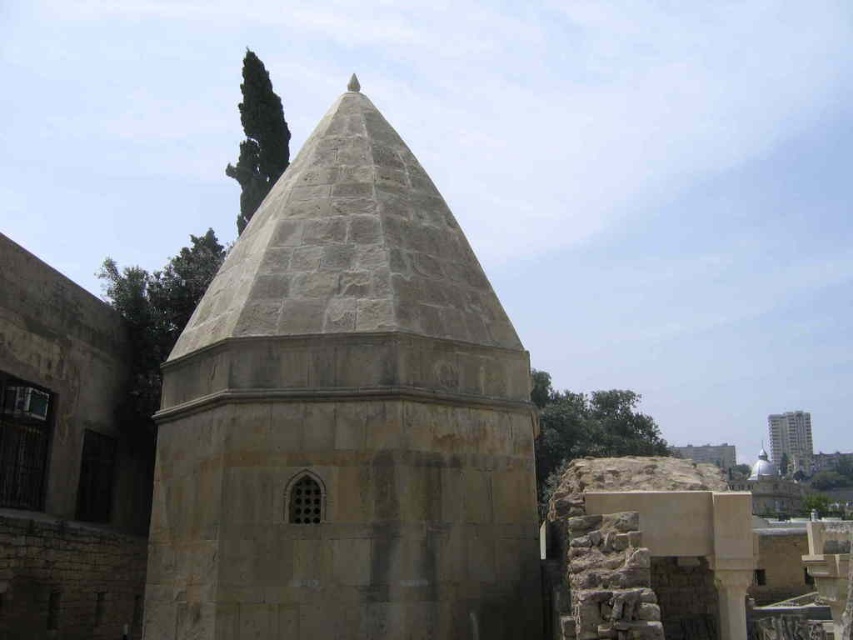
You are an architect examining this historical site. You need to determine which structure is narrower between the gray stone dome at center and the smooth concrete tower at right. Based on the scene, which one is narrower?

The gray stone dome at center has a lesser width compared to the smooth concrete tower at right, so the gray stone dome at center is narrower.

You are an architect examining the historical structure. You notice the gray stone dome at center and the smooth concrete tower at right. Which of these two structures is positioned to the left side of the other?

The gray stone dome at center is positioned to the left of the smooth concrete tower at right.

You are standing in front of the historical structure and want to take a photo. There are two points marked on the conical roof. Which point, point (340, 493) or point (805, 472), is closer to your camera lens?

Point (340, 493) is closer to the camera lens than point (805, 472).